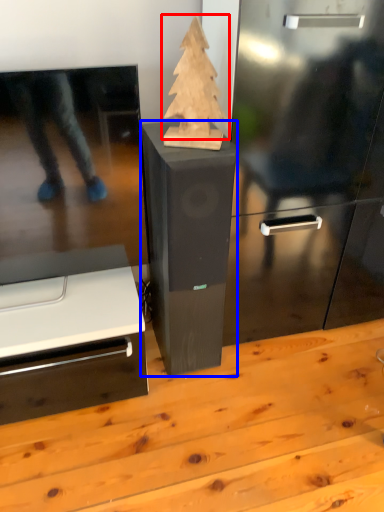
Question: Which object appears closest to the camera in this image, christmas tree (highlighted by a red box) or furniture (highlighted by a blue box)?

Choices:
 (A) christmas tree
 (B) furniture

Answer: (A)